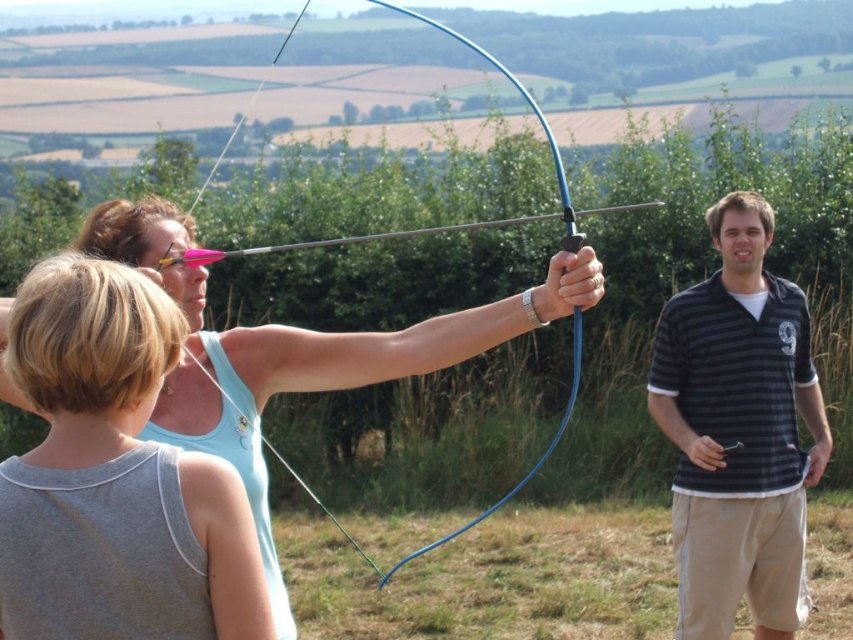
Question: Which object is positioned farthest from the black striped polo shirt at right?

Choices:
 (A) blue rubber bow at center
 (B) light blue tank top at center

Answer: (B)

Question: Observing the image, what is the correct spatial positioning of light blue tank top at center in reference to blue rubber bow at center?

Choices:
 (A) left
 (B) right

Answer: (A)

Question: Which point is closer to the camera taking this photo?

Choices:
 (A) (277, 326)
 (B) (61, 557)
 (C) (752, 460)

Answer: (B)

Question: Can you confirm if matte blue bow at center is wider than blue rubber bow at center?

Choices:
 (A) no
 (B) yes

Answer: (A)

Question: Based on their relative distances, which object is nearer to the matte blue bow at center?

Choices:
 (A) black striped polo shirt at right
 (B) blue rubber bow at center

Answer: (A)

Question: Does light blue tank top at center come in front of blue rubber bow at center?

Choices:
 (A) yes
 (B) no

Answer: (A)